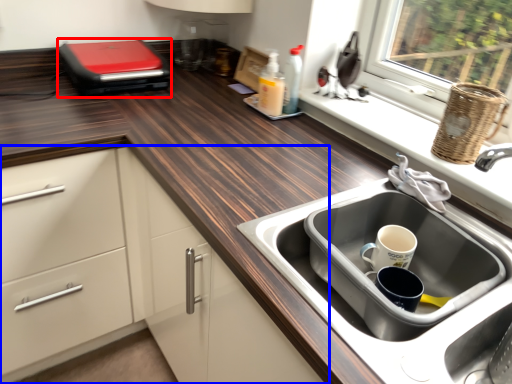
Question: Which of the following is the farthest to the observer, appliance (highlighted by a red box) or cabinetry (highlighted by a blue box)?

Choices:
 (A) appliance
 (B) cabinetry

Answer: (A)